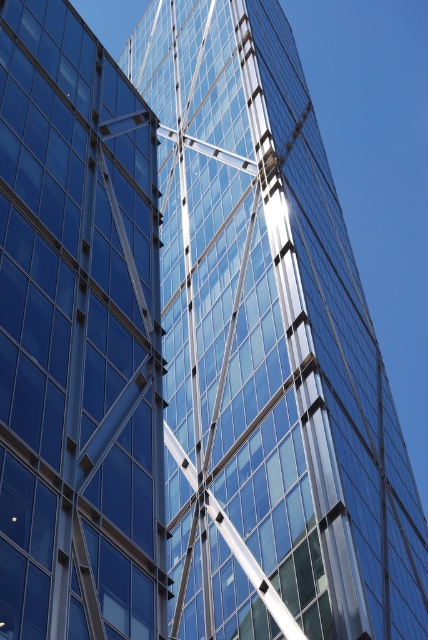
Question: Is transparent glass building at center positioned behind transparent glass building at left?

Choices:
 (A) yes
 (B) no

Answer: (A)

Question: Among these points, which one is farthest from the camera?

Choices:
 (A) (336, 499)
 (B) (80, 221)

Answer: (A)

Question: Considering the relative positions of transparent glass building at center and transparent glass building at left in the image provided, where is transparent glass building at center located with respect to transparent glass building at left?

Choices:
 (A) below
 (B) above

Answer: (B)

Question: Which object appears closest to the camera in this image?

Choices:
 (A) transparent glass building at left
 (B) transparent glass building at center

Answer: (A)

Question: Is transparent glass building at center thinner than transparent glass building at left?

Choices:
 (A) yes
 (B) no

Answer: (B)